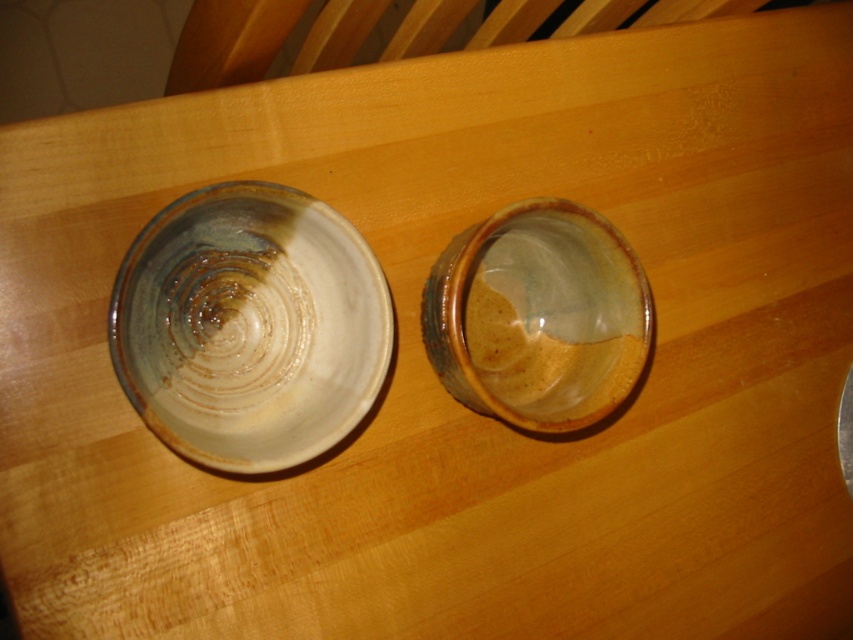
Can you confirm if matte ceramic bowl at left is taller than matte ceramic bowl at center?

Correct, matte ceramic bowl at left is much taller as matte ceramic bowl at center.

The width and height of the screenshot is (853, 640). Find the location of `matte ceramic bowl at left`. matte ceramic bowl at left is located at coordinates tap(248, 326).

Between point (173, 228) and point (650, 321), which one is positioned in front?

Positioned in front is point (173, 228).

The image size is (853, 640). Identify the location of matte ceramic bowl at left. (248, 326).